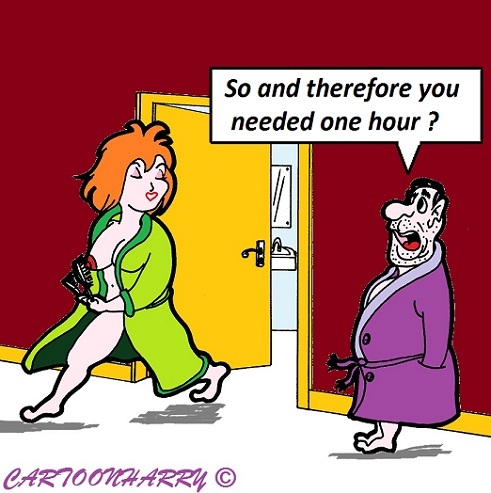
What are the coordinates of `red wall` in the screenshot? It's located at (21, 93).